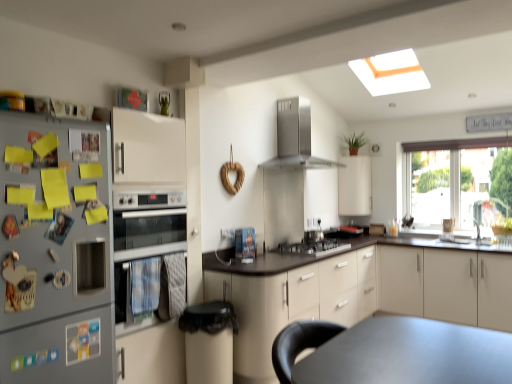
Question: Does stainless steel range hood at upper center come in front of white matte cabinet at upper center, which is counted as the second cabinetry, starting from the left?

Choices:
 (A) yes
 (B) no

Answer: (A)

Question: Is stainless steel range hood at upper center outside white matte cabinet at upper center, the second cabinetry viewed from the right?

Choices:
 (A) no
 (B) yes

Answer: (B)

Question: From a real-world perspective, is stainless steel range hood at upper center physically below white matte cabinet at upper center, the second cabinetry viewed from the right?

Choices:
 (A) no
 (B) yes

Answer: (A)

Question: Is stainless steel range hood at upper center positioned with its back to white matte cabinet at upper center, which is counted as the second cabinetry, starting from the left?

Choices:
 (A) yes
 (B) no

Answer: (B)

Question: From the image's perspective, would you say stainless steel range hood at upper center is shown under white matte cabinet at upper center, which is counted as the second cabinetry, starting from the left?

Choices:
 (A) no
 (B) yes

Answer: (A)

Question: Is stainless steel range hood at upper center smaller than white matte cabinet at upper center, the second cabinetry viewed from the right?

Choices:
 (A) yes
 (B) no

Answer: (B)

Question: Is transparent glass window at right turned away from satin silver gas stove at center?

Choices:
 (A) no
 (B) yes

Answer: (A)

Question: Considering the relative sizes of transparent glass window at right and satin silver gas stove at center in the image provided, is transparent glass window at right bigger than satin silver gas stove at center?

Choices:
 (A) yes
 (B) no

Answer: (A)

Question: Considering the relative sizes of transparent glass window at right and satin silver gas stove at center in the image provided, is transparent glass window at right smaller than satin silver gas stove at center?

Choices:
 (A) yes
 (B) no

Answer: (B)

Question: Are transparent glass window at right and satin silver gas stove at center far apart?

Choices:
 (A) yes
 (B) no

Answer: (A)

Question: Considering the relative sizes of transparent glass window at right and satin silver gas stove at center in the image provided, is transparent glass window at right taller than satin silver gas stove at center?

Choices:
 (A) no
 (B) yes

Answer: (B)

Question: Does transparent glass window at right appear on the right side of satin silver gas stove at center?

Choices:
 (A) yes
 (B) no

Answer: (A)

Question: Are satin silver cooktop at center and satin silver gas stove at center located far from each other?

Choices:
 (A) yes
 (B) no

Answer: (B)